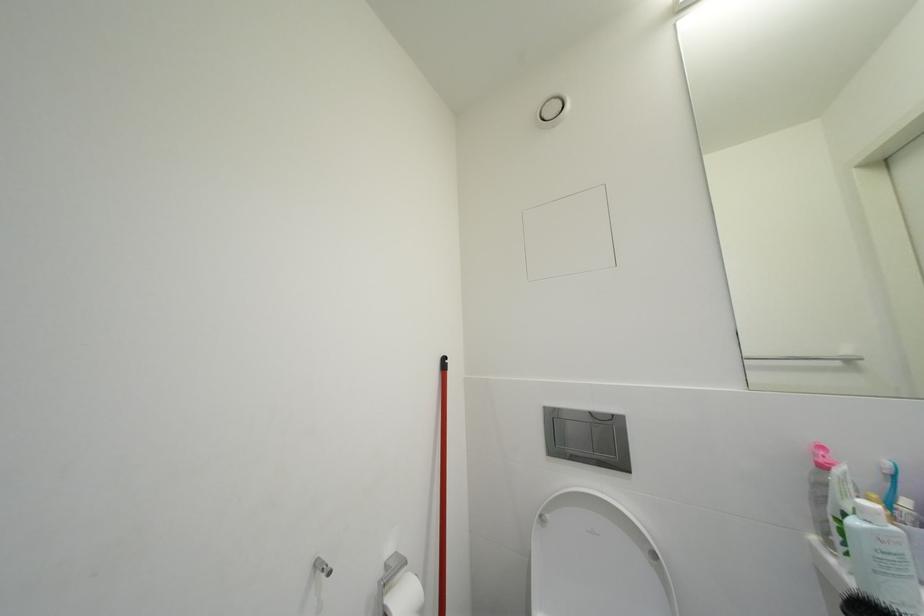
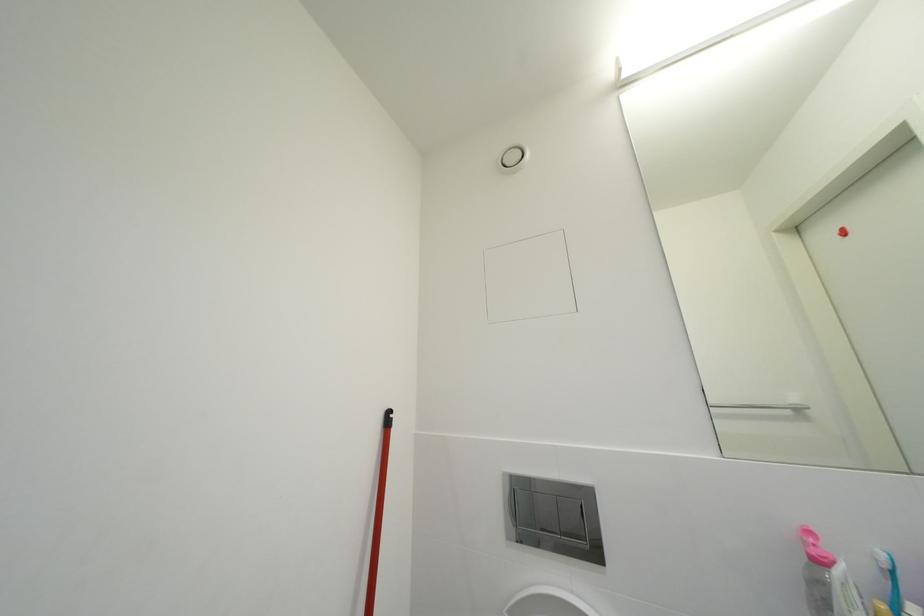
The images are taken continuously from a first-person perspective. In which direction are you moving?

The cameraman moved toward right, forward.